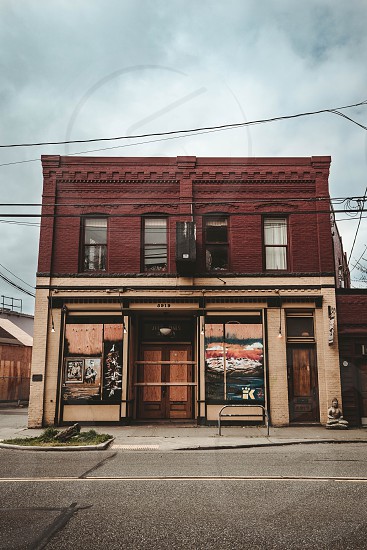
Where is `window curtain`? The image size is (367, 550). window curtain is located at coordinates (280, 235).